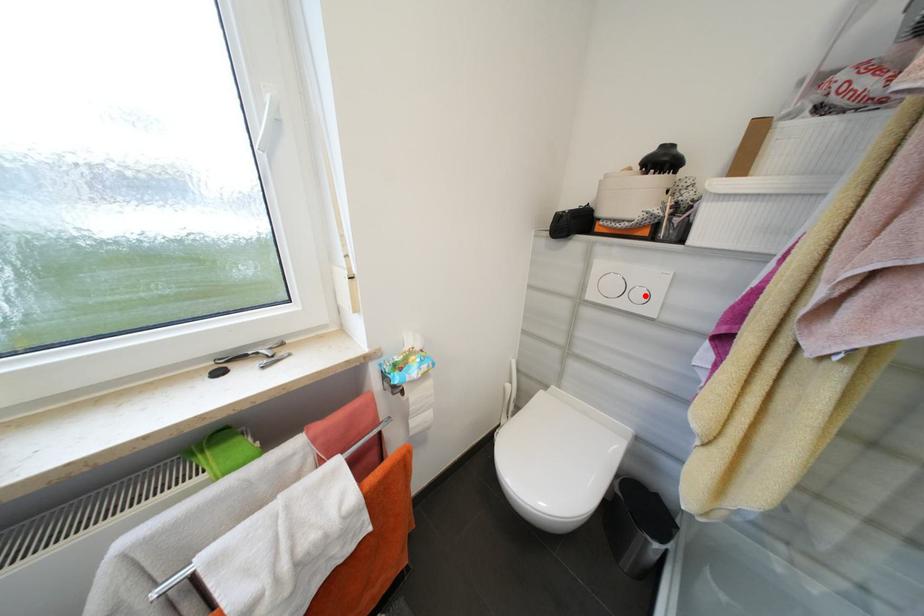
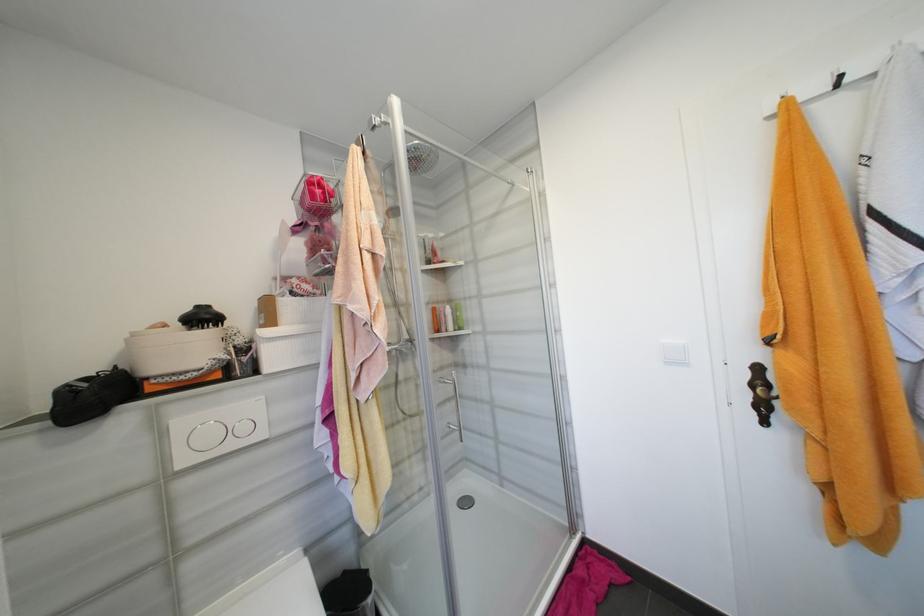
In the second image, find the point that corresponds to the highlighted location in the first image.

(249, 429)